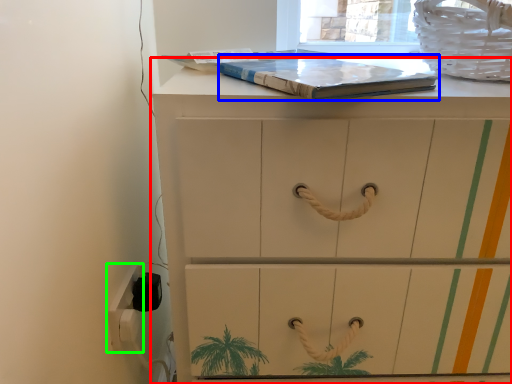
Question: Which object is the farthest from chest of drawers (highlighted by a red box)? Choose among these: paperback book (highlighted by a blue box) or electric outlet (highlighted by a green box).

Choices:
 (A) paperback book
 (B) electric outlet

Answer: (B)